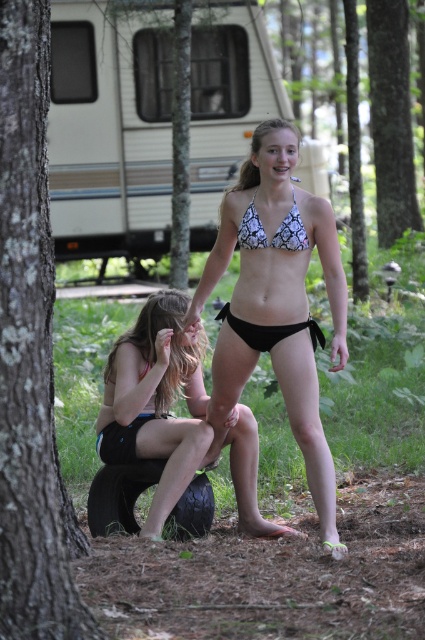
You are standing at the campsite and want to take a photo of the point at coordinates (51, 56). If your camera has a maximum focus range of 15 meters, will you be able to focus on that point?

The distance of point (51, 56) from the viewer is 16.06 meters, which exceeds the camera maximum focus range of 15 meters. Therefore, you won not be able to focus on that point.

You are standing at the center of the image and want to move towards the brown rough bark tree at left. Which direction should you head?

The brown rough bark tree at left is located at point 0.555 on the x axis and 0.073 on the y axis, so you should move towards the left and slightly downward from your current position to reach it.

You are standing at the point marked by the coordinates (31,355) in the image. Looking around, you see a brown rough bark tree at left. What is directly in front of you?

The point marked by the coordinates (31,355) is located at the brown rough bark tree at left, so directly in front of you would be the area where the two individuals are positioned near the tree trunk.